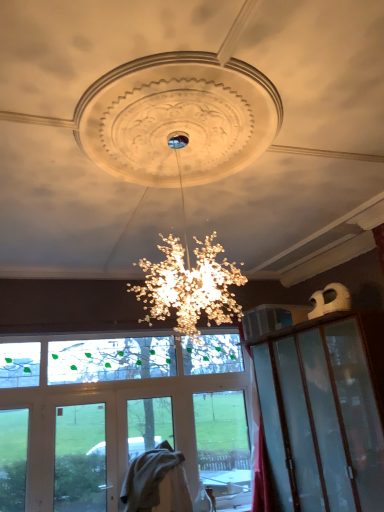
You are a GUI agent. You are given a task and a screenshot of the screen. Output one action in this format:
    pyautogui.click(x=<x>, y=<y>)
    Task: Click on the transparent glass window screen at center
    
    Given the screenshot: What is the action you would take?
    pyautogui.click(x=110, y=359)

Image resolution: width=384 pixels, height=512 pixels. Describe the element at coordinates (110, 359) in the screenshot. I see `transparent glass window screen at center` at that location.

At what (x,y) coordinates should I click in order to perform the action: click on clear glass door at center. Please return your answer as a coordinate pair (x, y). Image resolution: width=384 pixels, height=512 pixels. Looking at the image, I should click on (80, 458).

Describe the element at coordinates (80, 458) in the screenshot. I see `clear glass door at center` at that location.

Locate an element on the screen. The width and height of the screenshot is (384, 512). transparent glass window screen at center is located at coordinates (110, 359).

Does transparent glass window screen at center appear on the right side of clear glass door at center?

Correct, you'll find transparent glass window screen at center to the right of clear glass door at center.

Is transparent glass window screen at center in front of or behind clear glass door at center in the image?

transparent glass window screen at center is positioned farther from the viewer than clear glass door at center.

Considering the positions of point (68, 356) and point (84, 478), is point (68, 356) closer or farther from the camera than point (84, 478)?

Clearly, point (68, 356) is more distant from the camera than point (84, 478).

From the image's perspective, is transparent glass window screen at center above or below clear glass door at center?

Based on their image positions, transparent glass window screen at center is located above clear glass door at center.

From a real-world perspective, is transparent glass window screen at center physically above clear glass door at center?

Yes, from a real-world perspective, transparent glass window screen at center is on top of clear glass door at center.

Considering the sizes of transparent glass window screen at center and clear glass door at center in the image, is transparent glass window screen at center wider or thinner than clear glass door at center?

In the image, transparent glass window screen at center appears to be more narrow than clear glass door at center.

Considering the sizes of objects transparent glass window screen at center and clear glass door at center in the image provided, who is shorter, transparent glass window screen at center or clear glass door at center?

transparent glass window screen at center is shorter.

Between transparent glass window screen at center and clear glass door at center, which one has larger size?

transparent glass window screen at center.

Do you think transparent glass window screen at center is within clear glass door at center, or outside of it?

transparent glass window screen at center is located beyond the bounds of clear glass door at center.

Is transparent glass window screen at center placed right next to clear glass door at center?

No, transparent glass window screen at center is not making contact with clear glass door at center.

Is transparent glass window screen at center looking in the opposite direction of clear glass door at center?

That's not correct — transparent glass window screen at center is not looking away from clear glass door at center.

How different are the orientations of transparent glass window screen at center and clear glass door at center in degrees?

There is a 0.00197-degree angle between the facing directions of transparent glass window screen at center and clear glass door at center.

The width and height of the screenshot is (384, 512). What are the coordinates of `window screen behind the clear glass door at center` in the screenshot? It's located at (110, 359).

Consider the image. Between clear glass door at center and transparent glass window screen at center, which one appears on the right side from the viewer's perspective?

transparent glass window screen at center is more to the right.

Considering the positions of objects clear glass door at center and transparent glass window screen at center in the image provided, who is in front, clear glass door at center or transparent glass window screen at center?

Positioned in front is clear glass door at center.

Is point (75, 457) less distant than point (62, 342)?

Yes, point (75, 457) is in front of point (62, 342).

From the image's perspective, is clear glass door at center below transparent glass window screen at center?

Yes.

From a real-world perspective, is clear glass door at center above or below transparent glass window screen at center?

clear glass door at center is situated lower than transparent glass window screen at center in the real world.

Between clear glass door at center and transparent glass window screen at center, which one has smaller width?

transparent glass window screen at center is thinner.

Does clear glass door at center have a lesser height compared to transparent glass window screen at center?

Incorrect, the height of clear glass door at center does not fall short of that of transparent glass window screen at center.

Can you confirm if clear glass door at center is smaller than transparent glass window screen at center?

Indeed, clear glass door at center has a smaller size compared to transparent glass window screen at center.

Is transparent glass window screen at center surrounded by clear glass door at center?

No.

Is clear glass door at center directly adjacent to transparent glass window screen at center?

No.

Is clear glass door at center facing towards transparent glass window screen at center?

No.

How different are the orientations of clear glass door at center and transparent glass window screen at center in degrees?

clear glass door at center and transparent glass window screen at center are facing 0.00197 degrees away from each other.

Measure the distance between clear glass door at center and transparent glass window screen at center.

clear glass door at center and transparent glass window screen at center are 25.12 inches apart.

This screenshot has height=512, width=384. In order to click on window screen above the clear glass door at center (from the image's perspective) in this screenshot , I will do `click(110, 359)`.

Find the location of a particular element. glass window beneath the transparent glass window screen at center (from a real-world perspective) is located at coordinates (80, 458).

Identify the location of window screen that appears above the clear glass door at center (from the image's perspective). Image resolution: width=384 pixels, height=512 pixels. (110, 359).